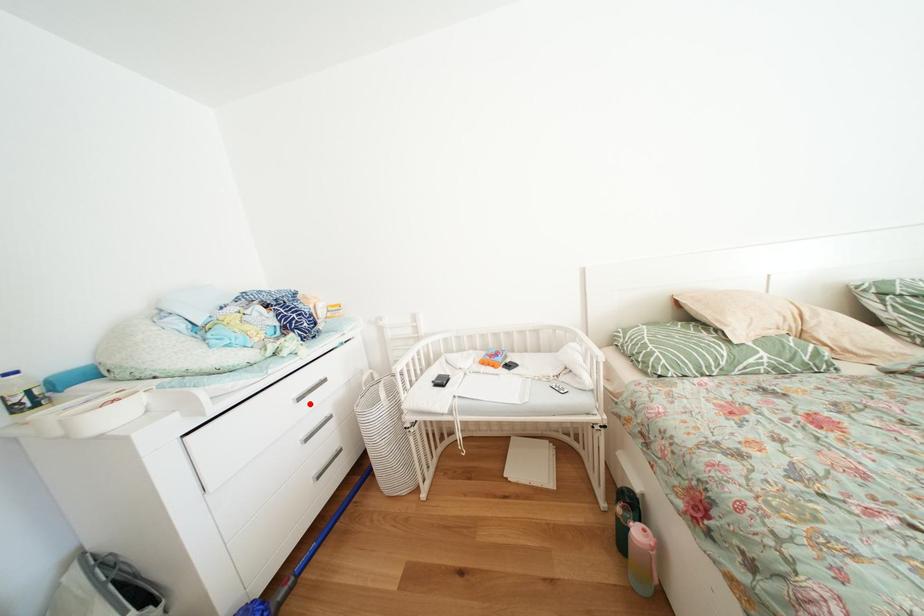
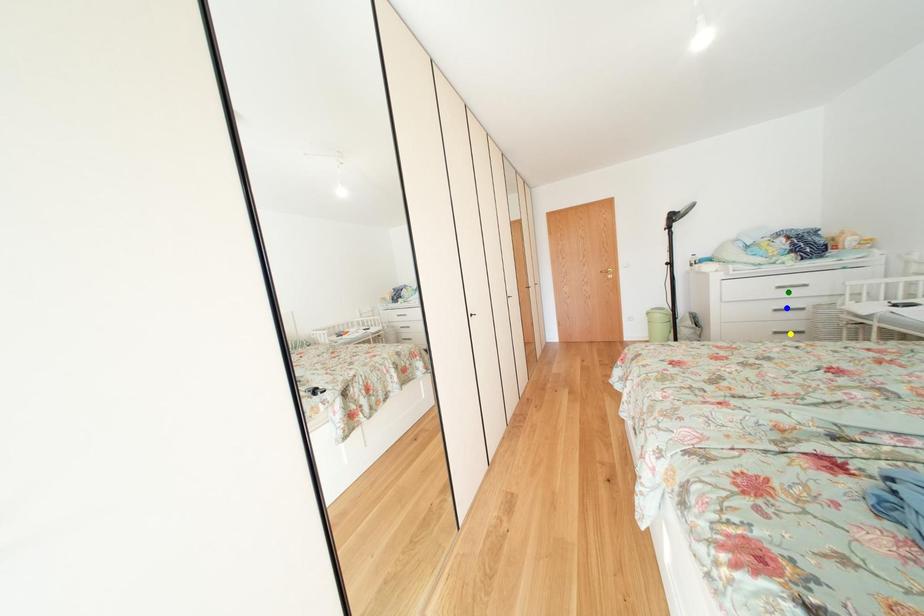
Question: I am providing you with two images of the same scene from different viewpoints. A red point is marked on the first image. You are given multiple points on the second image. Can you choose the point in image 2 that corresponds to the point in image 1?

Choices:
 (A) blue point
 (B) yellow point
 (C) green point

Answer: (C)